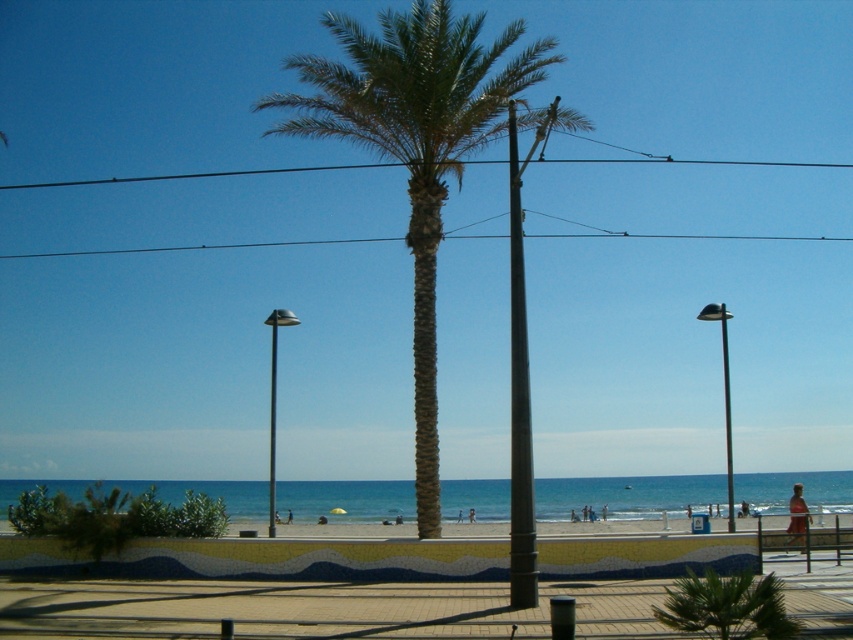
Question: Can you confirm if tan skin person at beach center is positioned above tan skin person at center?

Choices:
 (A) no
 (B) yes

Answer: (B)

Question: Can you confirm if tan skin person at lower right is positioned to the right of blue fabric person at center?

Choices:
 (A) yes
 (B) no

Answer: (A)

Question: Does tan skin person at lower right appear on the left side of blue fabric person at center?

Choices:
 (A) no
 (B) yes

Answer: (A)

Question: Which point is closer to the camera taking this photo?

Choices:
 (A) (798, 493)
 (B) (469, 522)
 (C) (480, 147)
 (D) (287, 516)

Answer: (A)

Question: Which point is farther to the camera?

Choices:
 (A) (291, 515)
 (B) (798, 484)
 (C) (457, 522)

Answer: (A)

Question: Which point is closer to the camera?

Choices:
 (A) tan skin person at center
 (B) tan skin person at beach center
 (C) tan skin person at lower right

Answer: (C)